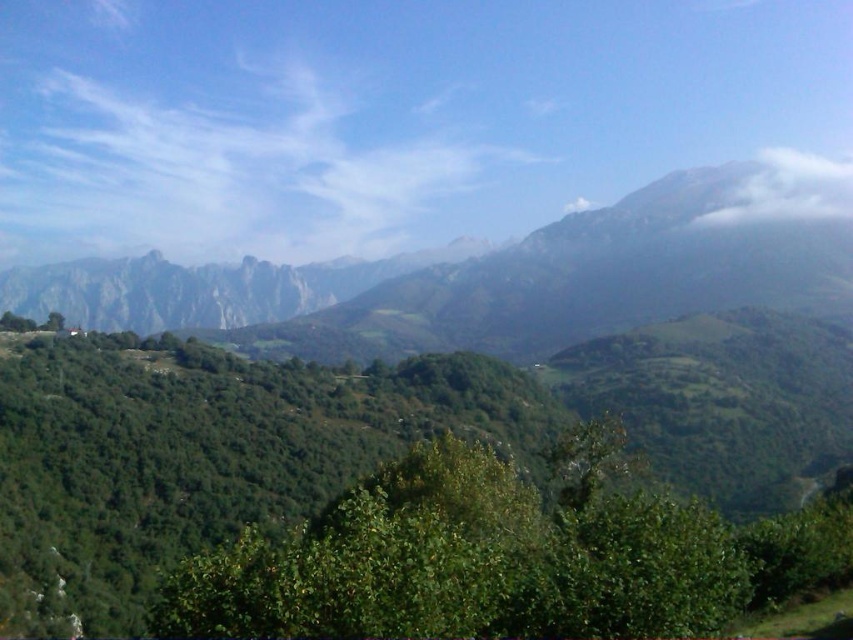
Question: Does green grassy mountain range at upper center appear on the left side of white fluffy cloud at upper right?

Choices:
 (A) yes
 (B) no

Answer: (A)

Question: Is green grassy mountain range at upper center in front of white fluffy cloud at upper right?

Choices:
 (A) yes
 (B) no

Answer: (A)

Question: Which point is farther from the camera taking this photo?

Choices:
 (A) (801, 212)
 (B) (815, 276)

Answer: (A)

Question: Can you confirm if green grassy mountain range at upper center is positioned to the right of white fluffy cloud at upper right?

Choices:
 (A) no
 (B) yes

Answer: (A)

Question: Among these objects, which one is farthest from the camera?

Choices:
 (A) white fluffy cloud at upper right
 (B) green grassy mountain range at upper center

Answer: (A)